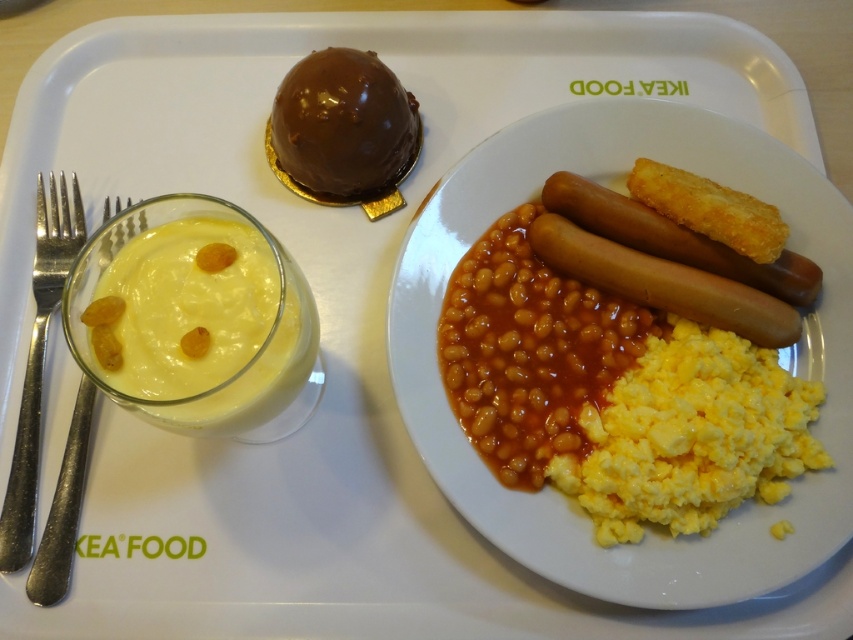
Question: Which point is farther to the camera?

Choices:
 (A) (625, 212)
 (B) (70, 426)

Answer: (A)

Question: Is brown matte hot dog at center to the right of silver metallic fork at left from the viewer's perspective?

Choices:
 (A) no
 (B) yes

Answer: (B)

Question: Is brown matte hot dog at center thinner than silver metallic fork at left?

Choices:
 (A) yes
 (B) no

Answer: (B)

Question: Which of the following is the farthest from the observer?

Choices:
 (A) (341, 81)
 (B) (83, 444)

Answer: (A)

Question: Estimate the real-world distances between objects in this image. Which object is closer to the chocolate glaze dome at upper center?

Choices:
 (A) brown matte hot dog at center-right
 (B) silver metallic fork at left
 (C) brown matte hot dog at center

Answer: (C)

Question: Is brown matte hot dog at center bigger than silvermetallicforks at left?

Choices:
 (A) yes
 (B) no

Answer: (B)